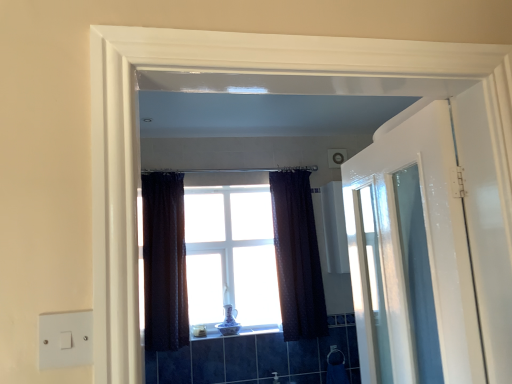
Locate an element on the screen. Image resolution: width=512 pixels, height=384 pixels. dark textured curtain at center, acting as the first curtain starting from the left is located at coordinates (164, 262).

Where is `white plastic switch at lower left`? The image size is (512, 384). white plastic switch at lower left is located at coordinates (65, 339).

Image resolution: width=512 pixels, height=384 pixels. What are the coordinates of `white glass window at center` in the screenshot? It's located at (231, 254).

Identify the location of dark textured curtain at center, which is the 1th curtain in right-to-left order. (297, 256).

Can you confirm if white plastic switch at lower left is thinner than white glossy door at right?

Correct, the width of white plastic switch at lower left is less than that of white glossy door at right.

Is white plastic switch at lower left at the left side of white glossy door at right?

Yes, white plastic switch at lower left is to the left of white glossy door at right.

Is white plastic switch at lower left far from white glossy door at right?

That's right, there is a large distance between white plastic switch at lower left and white glossy door at right.

Considering the sizes of objects white plastic switch at lower left and white glossy door at right in the image provided, who is bigger, white plastic switch at lower left or white glossy door at right?

With larger size is white glossy door at right.

Is the position of dark textured curtain at center, which is the 1th curtain in right-to-left order, more distant than that of white glossy door at right?

Yes, it is.

Based on their sizes in the image, would you say dark textured curtain at center, which is the 1th curtain in right-to-left order, is bigger or smaller than white glossy door at right?

Clearly, dark textured curtain at center, which is the 1th curtain in right-to-left order, is smaller in size than white glossy door at right.

From the image's perspective, which one is positioned higher, dark textured curtain at center, the second curtain when ordered from left to right, or white glossy door at right?

white glossy door at right appears higher in the image.

From a real-world perspective, is dark textured curtain at center, the second curtain when ordered from left to right, positioned under white glossy door at right based on gravity?

No, from a real-world perspective, dark textured curtain at center, the second curtain when ordered from left to right, is not under white glossy door at right.

From a real-world perspective, is satin nickel faucet at lower center on dark textured curtain at center, which is the 1th curtain in right-to-left order?

Incorrect, from a real-world perspective, satin nickel faucet at lower center is lower than dark textured curtain at center, which is the 1th curtain in right-to-left order.

Which point is more distant from viewer, (277, 374) or (312, 302)?

Point (312, 302)

Considering the positions of objects satin nickel faucet at lower center and dark textured curtain at center, the second curtain when ordered from left to right, in the image provided, who is more to the right, satin nickel faucet at lower center or dark textured curtain at center, the second curtain when ordered from left to right,?

dark textured curtain at center, the second curtain when ordered from left to right.

Measure the distance from dark textured curtain at center, acting as the first curtain starting from the left, to dark textured curtain at center, the second curtain when ordered from left to right.

dark textured curtain at center, acting as the first curtain starting from the left, and dark textured curtain at center, the second curtain when ordered from left to right, are 89.03 centimeters apart from each other.

From the image's perspective, is dark textured curtain at center, placed as the 2th curtain when sorted from right to left, below dark textured curtain at center, the second curtain when ordered from left to right?

Yes.

Which of these two, dark textured curtain at center, acting as the first curtain starting from the left, or dark textured curtain at center, the second curtain when ordered from left to right, is smaller?

dark textured curtain at center, acting as the first curtain starting from the left.

From a real-world perspective, relative to dark textured curtain at center, the second curtain when ordered from left to right, is dark textured curtain at center, acting as the first curtain starting from the left, vertically above or below?

dark textured curtain at center, acting as the first curtain starting from the left, is situated higher than dark textured curtain at center, the second curtain when ordered from left to right, in the real world.

Is there a large distance between white glossy door at right and white glass window at center?

Absolutely, white glossy door at right is distant from white glass window at center.

Which object is closer to the camera taking this photo, white glossy door at right or white glass window at center?

white glossy door at right is more forward.

From a real-world perspective, is white glossy door at right located higher than white glass window at center?

Actually, white glossy door at right is physically below white glass window at center in the real world.

The height and width of the screenshot is (384, 512). In the image, there is a white glass window at center. Identify the location of door above it (from the image's perspective). (411, 257).

From their relative heights in the image, would you say dark textured curtain at center, placed as the 2th curtain when sorted from right to left, is taller or shorter than white plastic switch at lower left?

In the image, dark textured curtain at center, placed as the 2th curtain when sorted from right to left, appears to be taller than white plastic switch at lower left.

In the scene shown: Is dark textured curtain at center, placed as the 2th curtain when sorted from right to left, turned away from white plastic switch at lower left?

No, dark textured curtain at center, placed as the 2th curtain when sorted from right to left, is not facing away from white plastic switch at lower left.

Does point (156, 273) come farther from viewer compared to point (89, 339)?

Yes, it is.

Who is shorter, satin nickel faucet at lower center or white glossy door at right?

satin nickel faucet at lower center is shorter.

What's the angular difference between satin nickel faucet at lower center and white glossy door at right's facing directions?

satin nickel faucet at lower center and white glossy door at right are facing 92.9 degrees away from each other.

Are satin nickel faucet at lower center and white glossy door at right located far from each other?

That's right, there is a large distance between satin nickel faucet at lower center and white glossy door at right.

From the image's perspective, is satin nickel faucet at lower center located above or below white glossy door at right?

From the image's perspective, satin nickel faucet at lower center appears below white glossy door at right.

Find the location of `door lying below the white plastic switch at lower left (from the image's perspective)`. door lying below the white plastic switch at lower left (from the image's perspective) is located at coordinates (411, 257).

This screenshot has width=512, height=384. In order to click on door on the right of dark textured curtain at center, the second curtain when ordered from left to right in this screenshot , I will do `click(411, 257)`.

Estimate the real-world distances between objects in this image. Which object is closer to white plastic switch at lower left, white glossy door at right or dark textured curtain at center, which is the 1th curtain in right-to-left order?

white glossy door at right lies closer to white plastic switch at lower left than the other object.

Consider the image. Estimate the real-world distances between objects in this image. Which object is closer to satin nickel faucet at lower center, dark textured curtain at center, acting as the first curtain starting from the left, or dark textured curtain at center, the second curtain when ordered from left to right?

dark textured curtain at center, the second curtain when ordered from left to right, is closer to satin nickel faucet at lower center.

Estimate the real-world distances between objects in this image. Which object is further from white plastic switch at lower left, dark textured curtain at center, the second curtain when ordered from left to right, or white glossy door at right?

The object further to white plastic switch at lower left is dark textured curtain at center, the second curtain when ordered from left to right.

Consider the image. Based on their spatial positions, is dark textured curtain at center, the second curtain when ordered from left to right, or dark textured curtain at center, acting as the first curtain starting from the left, closer to white glossy door at right?

dark textured curtain at center, the second curtain when ordered from left to right, is closer to white glossy door at right.

Considering their positions, is dark textured curtain at center, placed as the 2th curtain when sorted from right to left, positioned closer to white glass window at center than white plastic switch at lower left?

dark textured curtain at center, placed as the 2th curtain when sorted from right to left, lies closer to white glass window at center than the other object.

Which object lies further to the anchor point satin nickel faucet at lower center, white plastic switch at lower left or white glass window at center?

white plastic switch at lower left.

Estimate the real-world distances between objects in this image. Which object is closer to dark textured curtain at center, acting as the first curtain starting from the left, satin nickel faucet at lower center or dark textured curtain at center, which is the 1th curtain in right-to-left order?

dark textured curtain at center, which is the 1th curtain in right-to-left order, is positioned closer to the anchor dark textured curtain at center, acting as the first curtain starting from the left.

Looking at the image, which one is located further to white plastic switch at lower left, dark textured curtain at center, acting as the first curtain starting from the left, or dark textured curtain at center, which is the 1th curtain in right-to-left order?

dark textured curtain at center, which is the 1th curtain in right-to-left order, is positioned further to the anchor white plastic switch at lower left.

I want to click on door between white plastic switch at lower left and dark textured curtain at center, acting as the first curtain starting from the left, along the z-axis, so click(x=411, y=257).

Identify the location of door positioned between white plastic switch at lower left and white glass window at center from near to far. Image resolution: width=512 pixels, height=384 pixels. (411, 257).

Locate an element on the screen. Image resolution: width=512 pixels, height=384 pixels. window between dark textured curtain at center, acting as the first curtain starting from the left, and satin nickel faucet at lower center from top to bottom is located at coordinates (231, 254).

Identify the location of window between dark textured curtain at center, placed as the 2th curtain when sorted from right to left, and dark textured curtain at center, which is the 1th curtain in right-to-left order, from left to right. Image resolution: width=512 pixels, height=384 pixels. (231, 254).